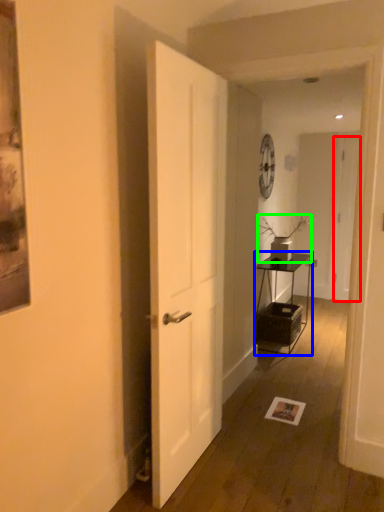
Question: Which object is positioned farthest from door (highlighted by a red box)? Select from table (highlighted by a blue box) and houseplant (highlighted by a green box).

Choices:
 (A) table
 (B) houseplant

Answer: (B)